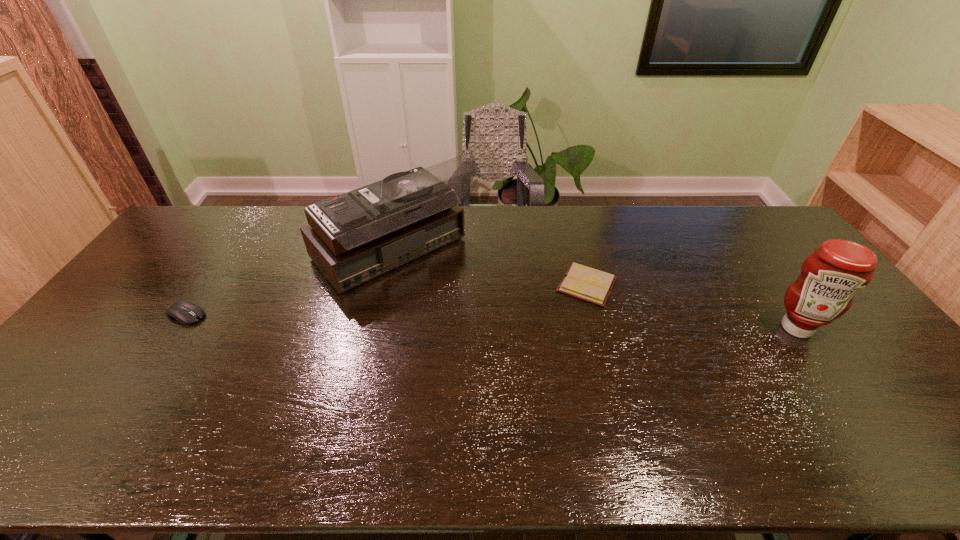
This screenshot has width=960, height=540. What are the coordinates of `object that stands as the second closest to the shortest object` in the screenshot? It's located at (830, 277).

This screenshot has width=960, height=540. What are the coordinates of `vacant point that satisfies the following two spatial constraints: 1. on the front side of the second object from right to left; 2. on the right side of the tallest object` in the screenshot? It's located at (388, 285).

Where is `free location that satisfies the following two spatial constraints: 1. on the back side of the diary; 2. on the right side of the computer equipment`? This screenshot has width=960, height=540. free location that satisfies the following two spatial constraints: 1. on the back side of the diary; 2. on the right side of the computer equipment is located at coordinates (206, 285).